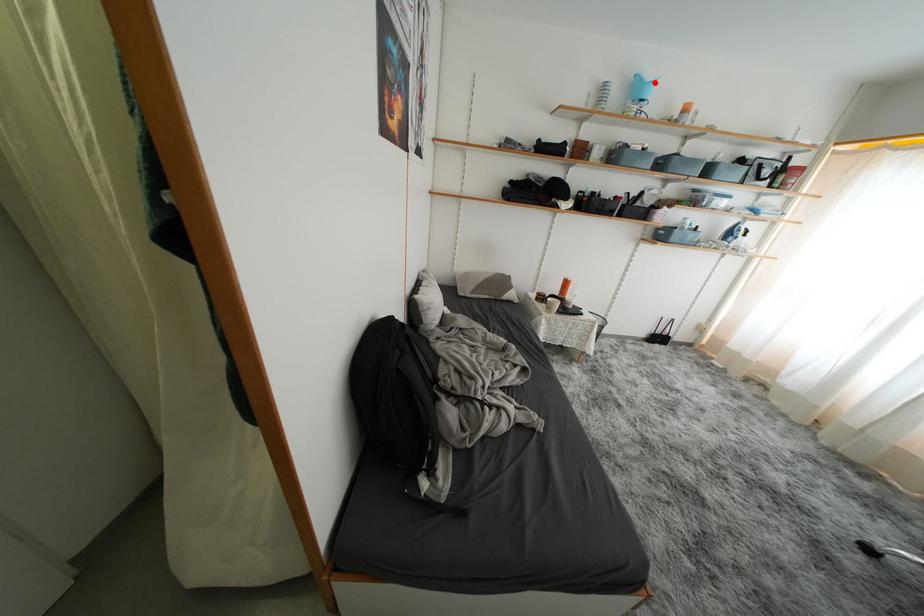
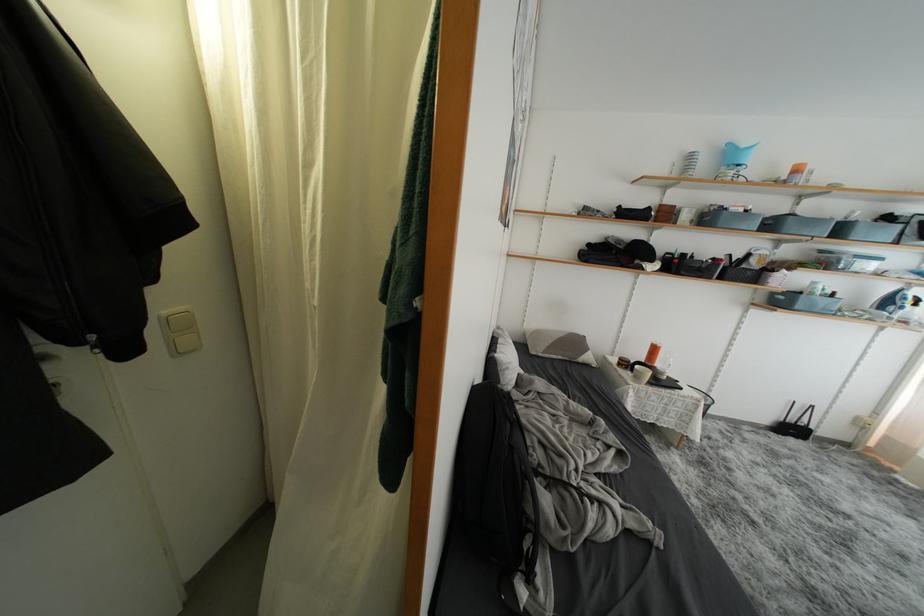
The point at the highlighted location is marked in the first image. Where is the corresponding point in the second image?

(749, 150)